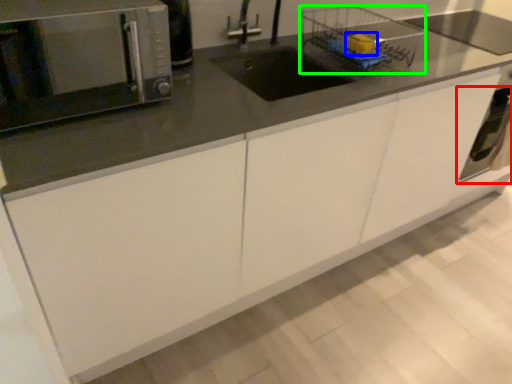
Question: Considering the real-world distances, which object is farthest from oven (highlighted by a red box)? food (highlighted by a blue box) or basket (highlighted by a green box)?

Choices:
 (A) food
 (B) basket

Answer: (A)